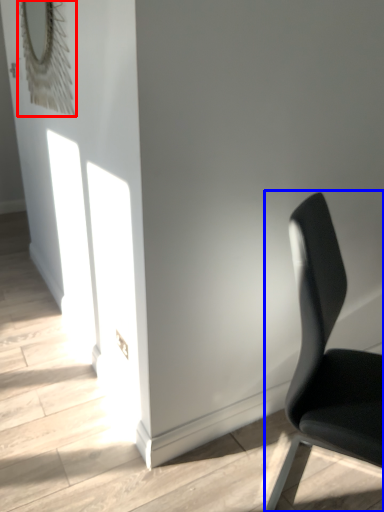
Question: Among these objects, which one is farthest to the camera, mirror (highlighted by a red box) or chair (highlighted by a blue box)?

Choices:
 (A) mirror
 (B) chair

Answer: (A)